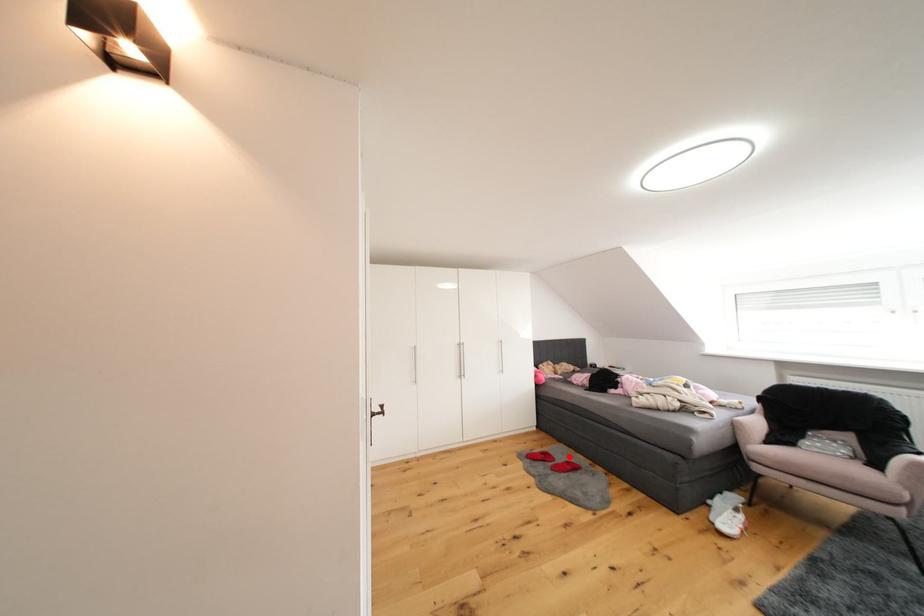
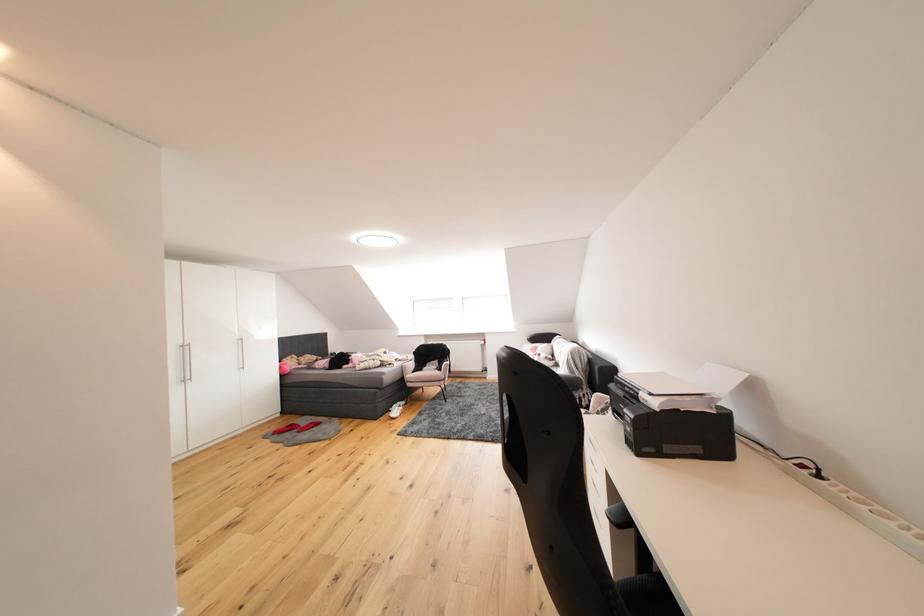
Question: I am providing you with two images of the same scene from different viewpoints. Image1 has a red point marked. In image2, the corresponding 3D location appears at what relative position? Reply with the corresponding letter.

Choices:
 (A) Closer
 (B) Farther

Answer: (B)